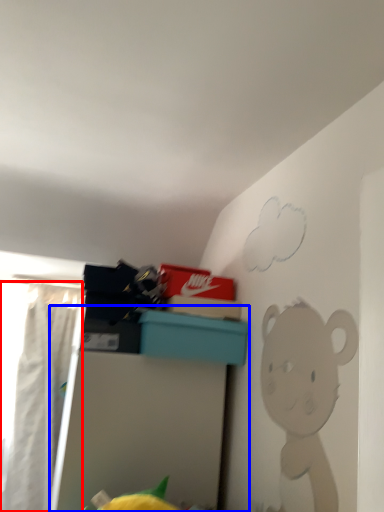
Question: Which of the following is the farthest to the observer, curtain (highlighted by a red box) or furniture (highlighted by a blue box)?

Choices:
 (A) curtain
 (B) furniture

Answer: (A)